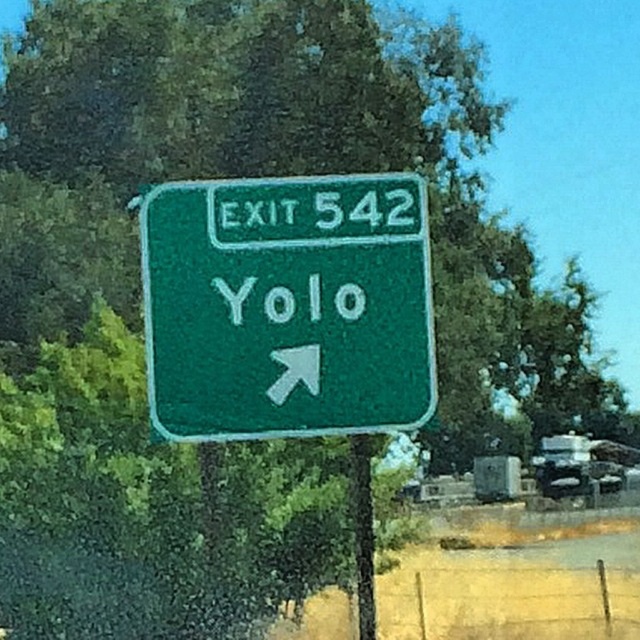
Question: Is green textured sign at center positioned before green painted metal pole at center?

Choices:
 (A) no
 (B) yes

Answer: (B)

Question: Which point is farther from the camera taking this photo?

Choices:
 (A) (369, 611)
 (B) (250, 380)

Answer: (A)

Question: Is green textured sign at center thinner than green painted metal pole at center?

Choices:
 (A) yes
 (B) no

Answer: (B)

Question: Is green textured sign at center to the left of green painted metal pole at center from the viewer's perspective?

Choices:
 (A) yes
 (B) no

Answer: (A)

Question: Which point is farther to the camera?

Choices:
 (A) (360, 580)
 (B) (145, 328)

Answer: (B)